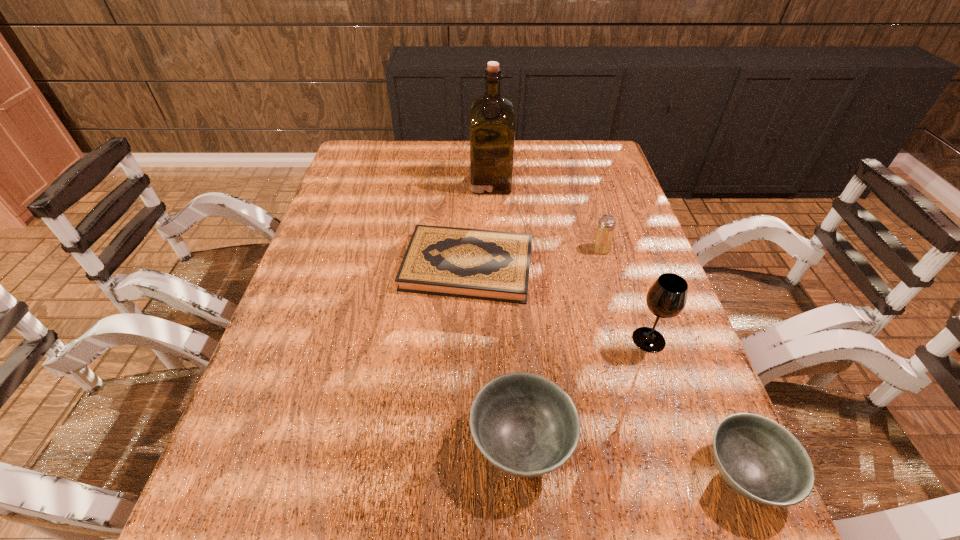
This screenshot has width=960, height=540. What are the coordinates of `the left bowl` in the screenshot? It's located at (525, 425).

Where is `the third shortest object`? The height and width of the screenshot is (540, 960). the third shortest object is located at coordinates pyautogui.click(x=525, y=425).

Image resolution: width=960 pixels, height=540 pixels. Identify the location of the second shortest object. (x=758, y=458).

You are a GUI agent. You are given a task and a screenshot of the screen. Output one action in this format:
    pyautogui.click(x=<x>, y=<y>)
    Task: Click on the shorter bowl
    Image resolution: width=960 pixels, height=540 pixels.
    Given the screenshot: What is the action you would take?
    pyautogui.click(x=758, y=458)

The image size is (960, 540). I want to click on liquor, so click(492, 117).

I want to click on the tallest object, so click(492, 117).

Find the location of a particular element. wineglass is located at coordinates (666, 298).

Locate an element on the screen. The image size is (960, 540). the fifth shortest object is located at coordinates (666, 298).

I want to click on the shortest object, so click(478, 264).

Locate an element on the screen. The height and width of the screenshot is (540, 960). saltshaker is located at coordinates (602, 242).